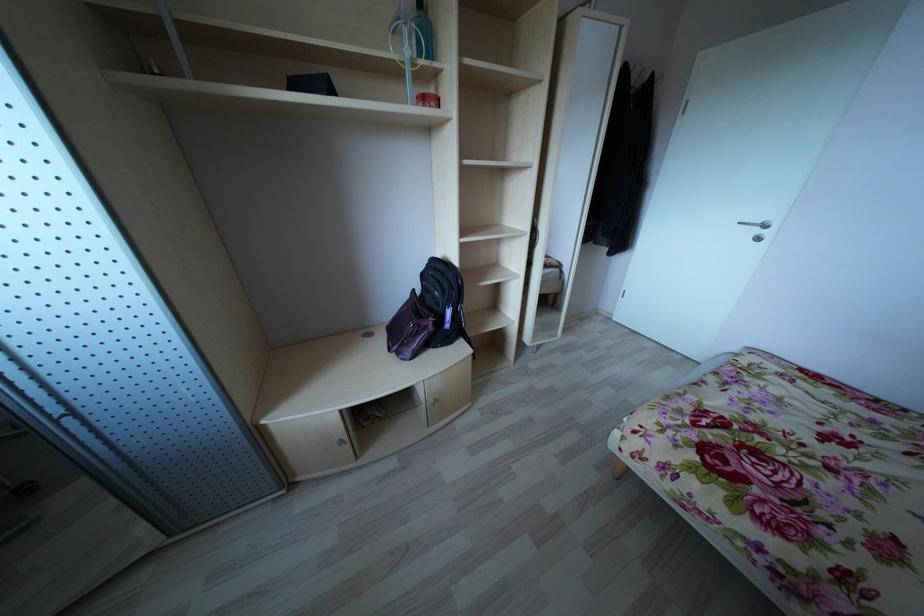
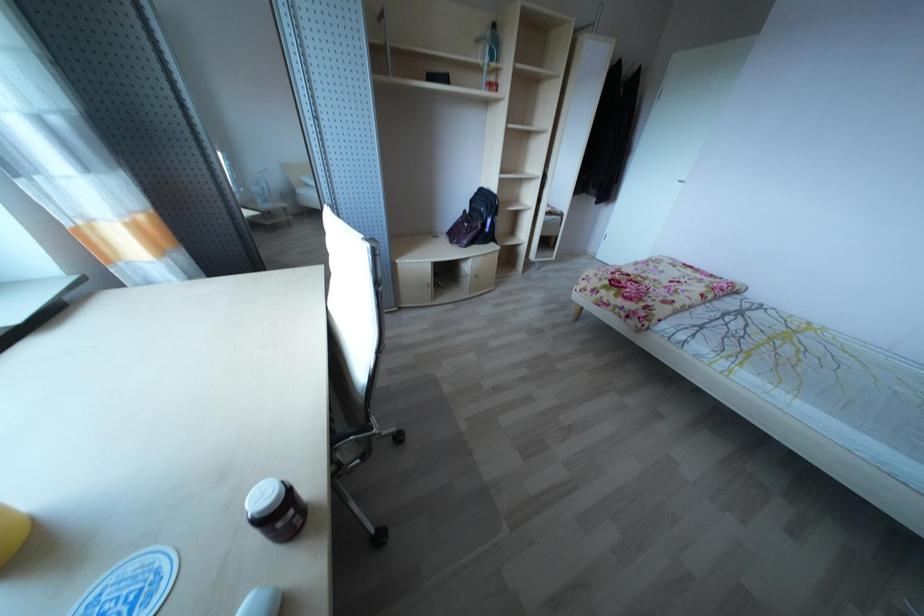
Question: Which direction would the cameraman need to move to produce the second image? Reply with the corresponding letter.

Choices:
 (A) Left
 (B) Right
 (C) Forward
 (D) Backward

Answer: (D)